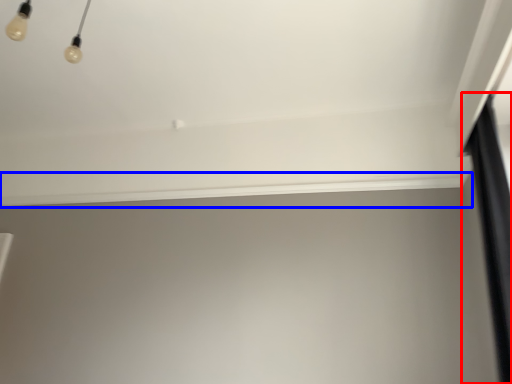
Question: Which of the following is the closest to the observer, curtain (highlighted by a red box) or window sill (highlighted by a blue box)?

Choices:
 (A) curtain
 (B) window sill

Answer: (A)